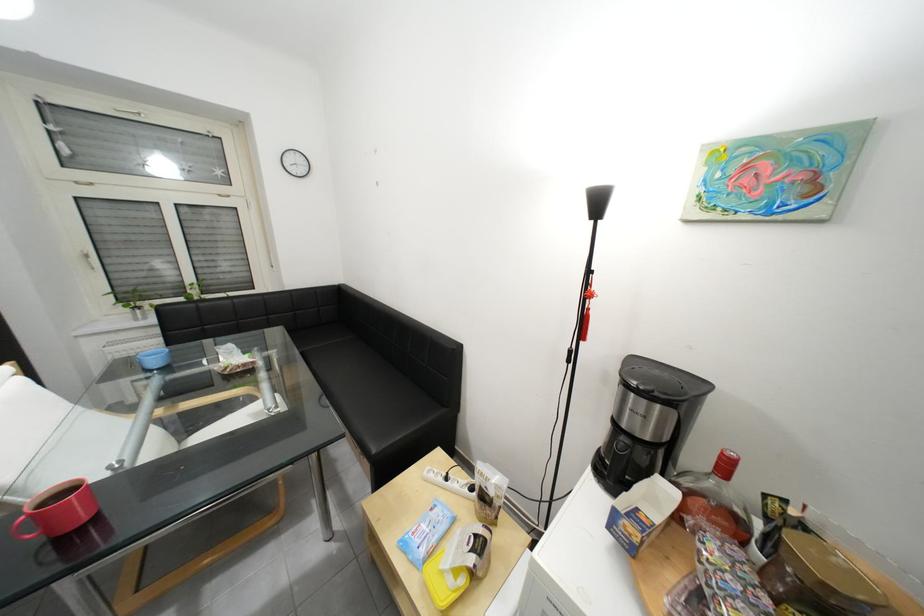
I want to click on yellow food container, so click(x=444, y=581).